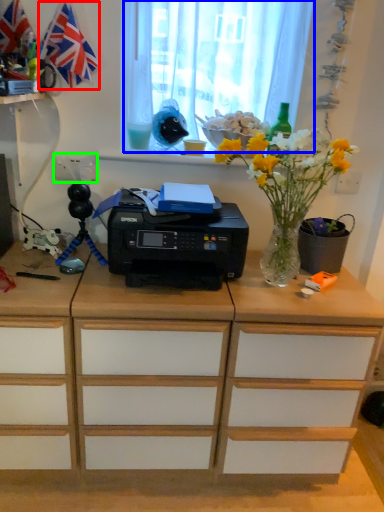
Question: Which object is positioned farthest from flag (highlighted by a red box)? Select from curtain (highlighted by a blue box) and electric outlet (highlighted by a green box).

Choices:
 (A) curtain
 (B) electric outlet

Answer: (A)